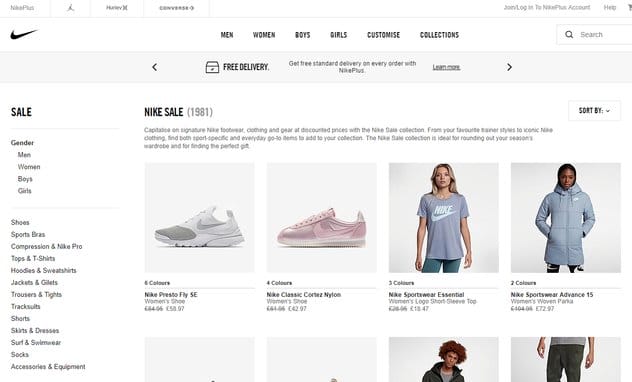
The width and height of the screenshot is (632, 382). I want to click on boxes, so click(217, 355), click(283, 357), click(399, 356), click(518, 359), click(531, 177), click(401, 183), click(325, 175), click(227, 174).